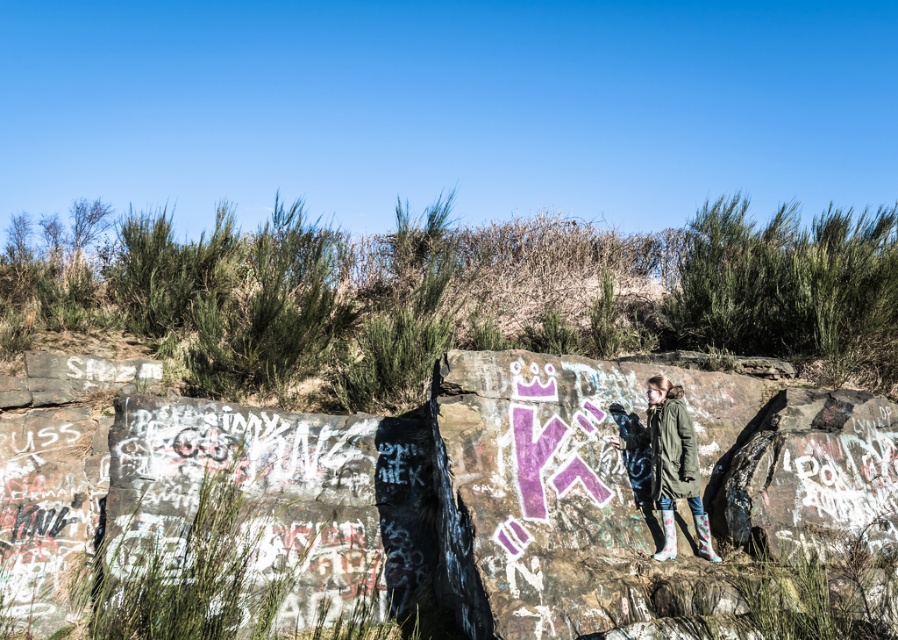
Can you confirm if green grass at center is taller than green matte jacket at center?

Yes, green grass at center is taller than green matte jacket at center.

Is point (624, 256) positioned behind point (656, 451)?

Yes.

Identify the location of green grass at center. This screenshot has width=898, height=640. (456, 292).

Can you confirm if rocky cliff at center is wider than green grass at center?

No, rocky cliff at center is not wider than green grass at center.

Which is in front, point (544, 483) or point (78, 282)?

Positioned in front is point (544, 483).

Identify the location of rocky cliff at center. This screenshot has width=898, height=640. (458, 497).

Measure the distance from rocky cliff at center to green matte jacket at center.

rocky cliff at center and green matte jacket at center are 1.14 meters apart.

Between point (468, 410) and point (672, 481), which one is positioned behind?

Positioned behind is point (468, 410).

At what (x,y) coordinates should I click in order to perform the action: click on rocky cliff at center. Please return your answer as a coordinate pair (x, y). The height and width of the screenshot is (640, 898). Looking at the image, I should click on (458, 497).